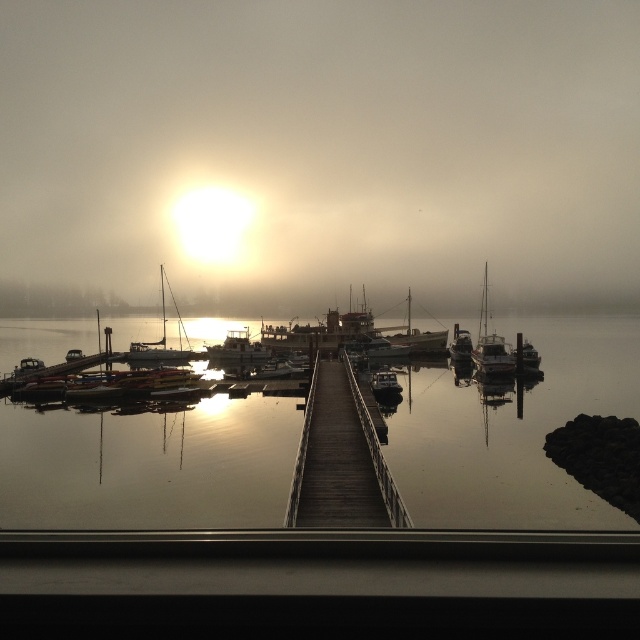
Question: Among these objects, which one is nearest to the camera?

Choices:
 (A) shiny silver boat at center right
 (B) metallic silver boat at right
 (C) shiny silver sailboat at right

Answer: (C)

Question: Can you confirm if shiny silver sailboat at left is smaller than metallic silver boat at center?

Choices:
 (A) yes
 (B) no

Answer: (B)

Question: Which of the following is the closest to the observer?

Choices:
 (A) shiny silver sailboat at left
 (B) metallic silver boat at center

Answer: (B)

Question: Which point is closer to the camera taking this photo?

Choices:
 (A) (474, 355)
 (B) (161, 289)
 (C) (458, 508)

Answer: (C)

Question: Is smooth water at center to the left of wooden dock at center from the viewer's perspective?

Choices:
 (A) yes
 (B) no

Answer: (A)

Question: Is shiny silver sailboat at left to the right of metallic silver boat at right from the viewer's perspective?

Choices:
 (A) no
 (B) yes

Answer: (A)